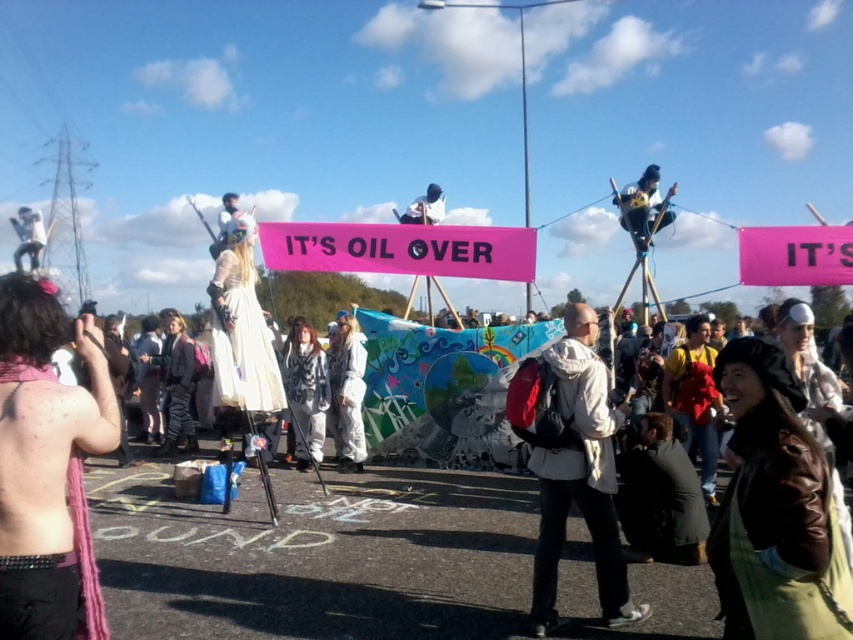
Question: Among these objects, which one is farthest from the camera?

Choices:
 (A) pink fabric banner at upper center
 (B) pink fabric banner at center
 (C) matte black helmet at center
 (D) white matte jacket at center

Answer: (C)

Question: Does pink scarf at lower left have a lesser width compared to pink fabric banner at center?

Choices:
 (A) no
 (B) yes

Answer: (B)

Question: Among these objects, which one is nearest to the camera?

Choices:
 (A) yellow fabric at upper right
 (B) matte black helmet at center
 (C) white matte jacket at center
 (D) brown leather jacket at lower right

Answer: (D)

Question: Which object appears closest to the camera in this image?

Choices:
 (A) white textured coat at center
 (B) white matte jacket at center
 (C) pink scarf at lower left
 (D) matte black helmet at center

Answer: (C)

Question: Does brown leather jacket at lower right appear on the right side of white fabric figure at upper left?

Choices:
 (A) no
 (B) yes

Answer: (B)

Question: Does pink scarf at lower left appear over white matte jacket at center?

Choices:
 (A) no
 (B) yes

Answer: (B)